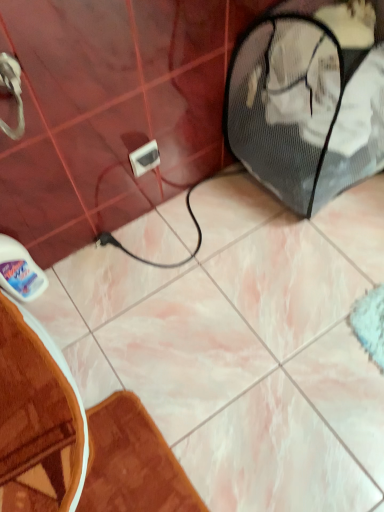
The image size is (384, 512). Describe the element at coordinates (145, 158) in the screenshot. I see `white plastic outlet at center` at that location.

At what (x,y) coordinates should I click in order to perform the action: click on white plastic outlet at center. Please return your answer as a coordinate pair (x, y). Looking at the image, I should click on (145, 158).

This screenshot has height=512, width=384. I want to click on brown textured bath mat at lower left, so click(132, 463).

Describe the element at coordinates (132, 463) in the screenshot. The height and width of the screenshot is (512, 384). I see `brown textured bath mat at lower left` at that location.

At what (x,y) coordinates should I click in order to perform the action: click on white plastic outlet at center. Please return your answer as a coordinate pair (x, y). Image resolution: width=384 pixels, height=512 pixels. Looking at the image, I should click on (145, 158).

Is brown textured bath mat at lower left to the left of white plastic outlet at center from the viewer's perspective?

Correct, you'll find brown textured bath mat at lower left to the left of white plastic outlet at center.

Which object is closer to the camera, brown textured bath mat at lower left or white plastic outlet at center?

brown textured bath mat at lower left is in front.

Does point (111, 454) lie behind point (148, 160)?

No, it is in front of (148, 160).

From the picture: From the image's perspective, is brown textured bath mat at lower left on white plastic outlet at center?

Actually, brown textured bath mat at lower left appears below white plastic outlet at center in the image.

From a real-world perspective, is brown textured bath mat at lower left positioned under white plastic outlet at center based on gravity?

Yes, from a real-world perspective, brown textured bath mat at lower left is beneath white plastic outlet at center.

Considering the relative sizes of brown textured bath mat at lower left and white plastic outlet at center in the image provided, is brown textured bath mat at lower left wider than white plastic outlet at center?

Correct, the width of brown textured bath mat at lower left exceeds that of white plastic outlet at center.

Considering the relative sizes of brown textured bath mat at lower left and white plastic outlet at center in the image provided, is brown textured bath mat at lower left taller than white plastic outlet at center?

Incorrect, the height of brown textured bath mat at lower left is not larger of that of white plastic outlet at center.

Between brown textured bath mat at lower left and white plastic outlet at center, which one has larger size?

brown textured bath mat at lower left.

Do you think brown textured bath mat at lower left is within white plastic outlet at center, or outside of it?

brown textured bath mat at lower left lies outside white plastic outlet at center.

Is brown textured bath mat at lower left beside white plastic outlet at center?

No, brown textured bath mat at lower left is not making contact with white plastic outlet at center.

Is brown textured bath mat at lower left positioned with its back to white plastic outlet at center?

No, white plastic outlet at center is not at the back of brown textured bath mat at lower left.

Can you tell me how much brown textured bath mat at lower left and white plastic outlet at center differ in facing direction?

brown textured bath mat at lower left and white plastic outlet at center are facing 3.02 degrees away from each other.

Measure the distance between brown textured bath mat at lower left and white plastic outlet at center.

A distance of 27.63 inches exists between brown textured bath mat at lower left and white plastic outlet at center.

Locate an element on the screen. electric outlet behind the brown textured bath mat at lower left is located at coordinates (145, 158).

Is white plastic outlet at center to the right of brown textured bath mat at lower left from the viewer's perspective?

Indeed, white plastic outlet at center is positioned on the right side of brown textured bath mat at lower left.

Which object is further away from the camera, white plastic outlet at center or brown textured bath mat at lower left?

Positioned behind is white plastic outlet at center.

Does point (139, 170) come in front of point (150, 508)?

No, it is behind (150, 508).

From the image's perspective, who appears lower, white plastic outlet at center or brown textured bath mat at lower left?

brown textured bath mat at lower left is shown below in the image.

From a real-world perspective, is white plastic outlet at center positioned above or below brown textured bath mat at lower left?

white plastic outlet at center is above brown textured bath mat at lower left.

Considering the sizes of objects white plastic outlet at center and brown textured bath mat at lower left in the image provided, who is wider, white plastic outlet at center or brown textured bath mat at lower left?

brown textured bath mat at lower left.

In terms of height, does white plastic outlet at center look taller or shorter compared to brown textured bath mat at lower left?

white plastic outlet at center is taller than brown textured bath mat at lower left.

Which of these two, white plastic outlet at center or brown textured bath mat at lower left, is bigger?

Bigger between the two is brown textured bath mat at lower left.

Is brown textured bath mat at lower left surrounded by white plastic outlet at center?

No, brown textured bath mat at lower left is located outside of white plastic outlet at center.

Is white plastic outlet at center beside brown textured bath mat at lower left?

No, white plastic outlet at center is not in contact with brown textured bath mat at lower left.

Is white plastic outlet at center turned away from brown textured bath mat at lower left?

No.

How many degrees apart are the facing directions of white plastic outlet at center and brown textured bath mat at lower left?

3.02 degrees separate the facing orientations of white plastic outlet at center and brown textured bath mat at lower left.

Where is `bath mat that appears in front of the white plastic outlet at center`? bath mat that appears in front of the white plastic outlet at center is located at coordinates (132, 463).

You are a GUI agent. You are given a task and a screenshot of the screen. Output one action in this format:
    pyautogui.click(x=<x>, y=<y>)
    Task: Click on the electric outlet lying above the brown textured bath mat at lower left (from the image's perspective)
    The image size is (384, 512).
    Given the screenshot: What is the action you would take?
    pyautogui.click(x=145, y=158)

Find the location of `electric outlet above the brown textured bath mat at lower left (from a real-world perspective)`. electric outlet above the brown textured bath mat at lower left (from a real-world perspective) is located at coordinates (145, 158).